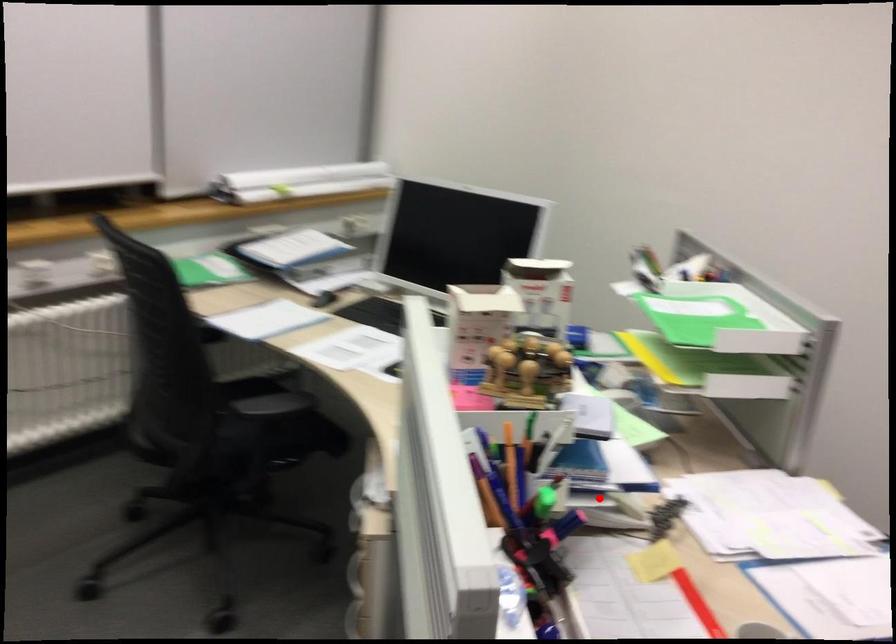
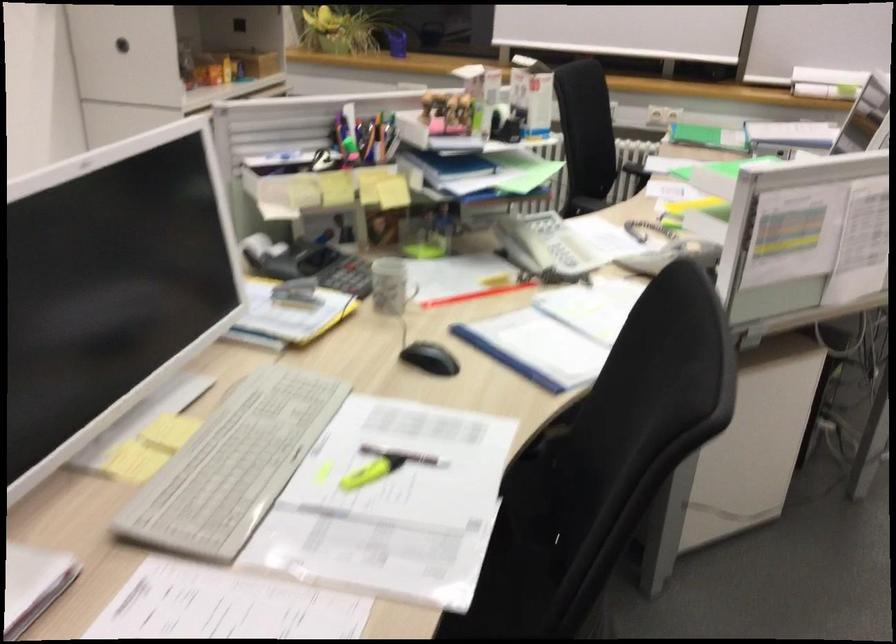
Where in the second image is the point corresponding to the highlighted location from the first image?

(522, 243)